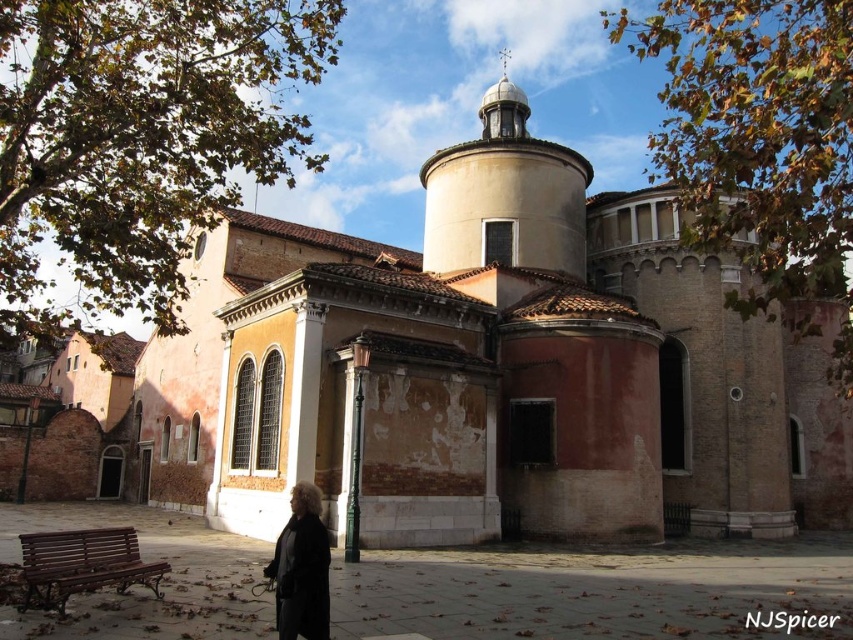
Question: In this image, where is smooth white dome at upper center located relative to wooden bench at lower left?

Choices:
 (A) above
 (B) below

Answer: (A)

Question: Does smooth white dome at upper center have a larger size compared to wooden bench at lower left?

Choices:
 (A) yes
 (B) no

Answer: (A)

Question: Among these objects, which one is farthest from the camera?

Choices:
 (A) smooth white dome at upper center
 (B) black wool coat at lower left

Answer: (A)

Question: Is smooth white dome at upper center to the left of black wool coat at lower left from the viewer's perspective?

Choices:
 (A) no
 (B) yes

Answer: (A)

Question: Which object is positioned farthest from the wooden bench at lower left?

Choices:
 (A) black wool coat at lower left
 (B) smooth white dome at upper center

Answer: (B)

Question: Which point is farther from the camera taking this photo?

Choices:
 (A) (22, 602)
 (B) (296, 561)

Answer: (A)